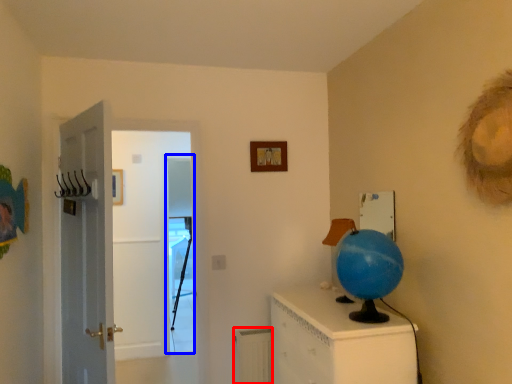
Question: Among these objects, which one is farthest to the camera, radiator (highlighted by a red box) or screen door (highlighted by a blue box)?

Choices:
 (A) radiator
 (B) screen door

Answer: (B)